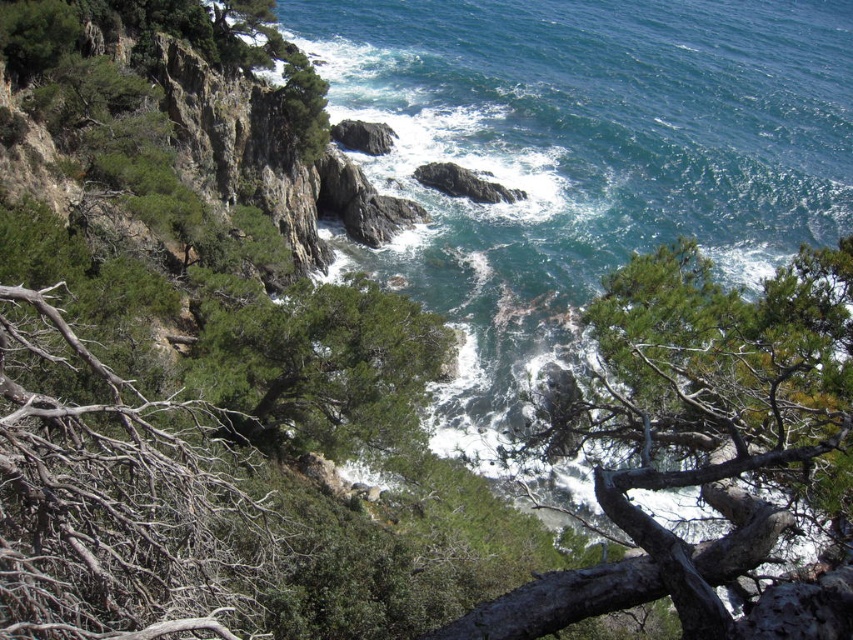
You are standing at the edge of the cliff overlooking the sea in the image. There are two points marked on the cliff face. The first point is at coordinates point (x=376, y=412) and the second is at point (x=355, y=129). If you were to throw a pebble at each point, which point would you hit first if you aim directly forward?

Point (x=376, y=412) is in front of point (x=355, y=129), so you would hit the first point first because it is closer to you.

In the scene shown: You are a hiker who wants to take a photo of the green rough tree at center and the brown dry branches at left. Which object should you stand closer to in order to capture both in the frame without zooming?

You should stand closer to the brown dry branches at left because the green rough tree at center is much taller, so moving closer to the shorter object allows both to be in the frame without zooming.